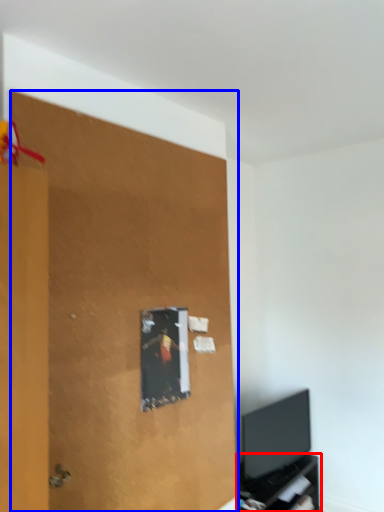
Question: Which point is further to the camera, tv cabinet (highlighted by a red box) or plywood (highlighted by a blue box)?

Choices:
 (A) tv cabinet
 (B) plywood

Answer: (A)